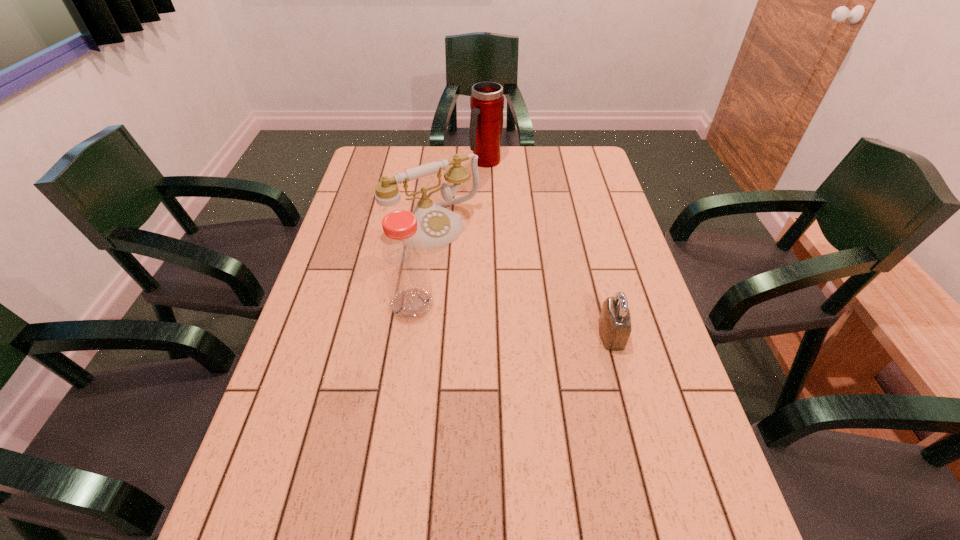
In the image, there is a desktop. At what (x,y) coordinates should I click in order to perform the action: click on vacant space at the far right corner. Please return your answer as a coordinate pair (x, y). Looking at the image, I should click on (572, 154).

You are a GUI agent. You are given a task and a screenshot of the screen. Output one action in this format:
    pyautogui.click(x=<x>, y=<y>)
    Task: Click on the free area in between the farthest object and the third nearest object
    The image size is (960, 540).
    Given the screenshot: What is the action you would take?
    pyautogui.click(x=460, y=194)

The image size is (960, 540). In order to click on vacant space that is in between the telephone and the farthest object in this screenshot , I will do `click(460, 194)`.

Where is `free space between the third tallest object and the shortest object`? The width and height of the screenshot is (960, 540). free space between the third tallest object and the shortest object is located at coordinates (522, 280).

The height and width of the screenshot is (540, 960). Find the location of `empty location between the shortest object and the thermos bottle`. empty location between the shortest object and the thermos bottle is located at coordinates (548, 248).

At what (x,y) coordinates should I click in order to perform the action: click on free space between the shortest object and the farthest object. Please return your answer as a coordinate pair (x, y). Looking at the image, I should click on (548, 248).

Where is `free space between the bottle and the shortest object`? free space between the bottle and the shortest object is located at coordinates (512, 319).

Identify the location of free space that is in between the farthest object and the second farthest object. This screenshot has width=960, height=540. (460, 194).

Find the location of a particular element. This screenshot has height=540, width=960. vacant space that's between the padlock and the farthest object is located at coordinates (548, 248).

At what (x,y) coordinates should I click in order to perform the action: click on unoccupied area between the farthest object and the rightmost object. Please return your answer as a coordinate pair (x, y). Looking at the image, I should click on (548, 248).